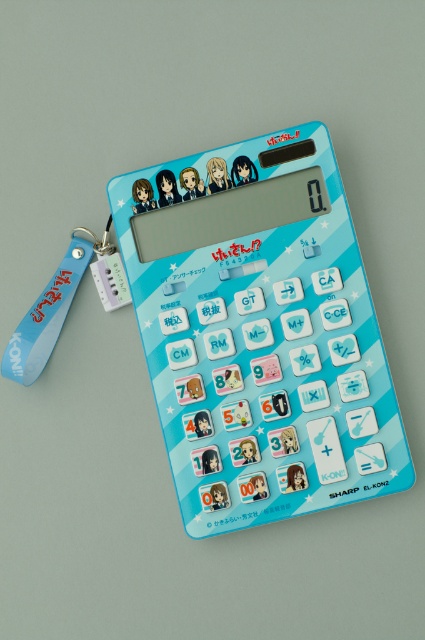
You have a blue plastic calculator at center and a blue rubber lanyard at lower left. Which one is wider?

The blue plastic calculator at center is wider than the blue rubber lanyard at lower left.

You are holding a blue plastic calculator at center and want to attach a blue rubber lanyard at lower left to it. Is the lanyard currently positioned behind the calculator?

The blue plastic calculator at center is in front of the blue rubber lanyard at lower left, so yes, the lanyard is positioned behind the calculator.